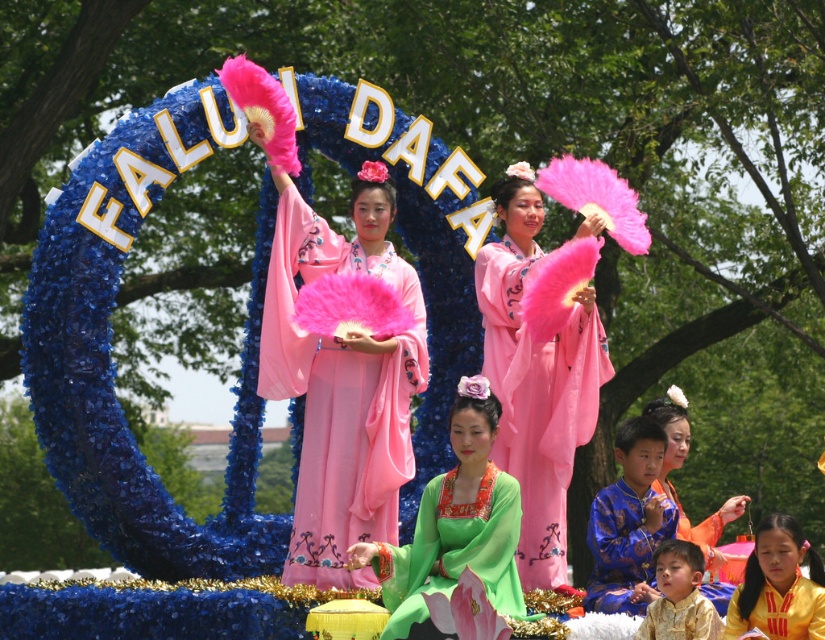
Question: Does green silk dress at center have a larger size compared to silky orange robe at center?

Choices:
 (A) yes
 (B) no

Answer: (B)

Question: Which point is farther to the camera?

Choices:
 (A) (321, 224)
 (B) (634, 508)
 (C) (755, 540)

Answer: (B)

Question: In this image, where is pink satin kimono at center located relative to green silk dress at lower right?

Choices:
 (A) left
 (B) right

Answer: (A)

Question: Which object is positioned farthest from the green silk dress at lower right?

Choices:
 (A) blue silk robe at lower right
 (B) gold silk robe at lower right
 (C) silky orange robe at center
 (D) pink satin kimono at center

Answer: (D)

Question: Does green silk dress at center appear under silky orange robe at center?

Choices:
 (A) no
 (B) yes

Answer: (B)

Question: Among these points, which one is nearest to the camera?

Choices:
 (A) (648, 548)
 (B) (681, 531)
 (C) (380, 436)

Answer: (C)